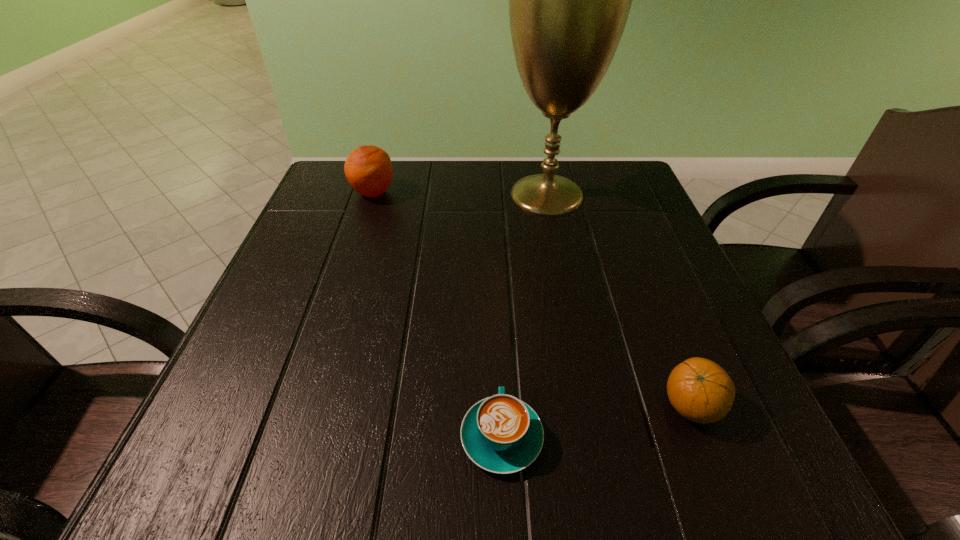
Where is `free spot located with the handle on the right side of the shortest object`? This screenshot has width=960, height=540. free spot located with the handle on the right side of the shortest object is located at coordinates (495, 276).

Find the location of `vacant space located with the handle on the right side of the shortest object`. vacant space located with the handle on the right side of the shortest object is located at coordinates (498, 352).

What are the coordinates of `trophy cup situated at the far edge` in the screenshot? It's located at (569, 0).

The width and height of the screenshot is (960, 540). I want to click on orange that is at the far edge, so click(x=368, y=169).

The width and height of the screenshot is (960, 540). Find the location of `orange that is positioned at the near edge`. orange that is positioned at the near edge is located at coordinates (700, 390).

Where is `cappuccino that is at the near edge`? This screenshot has height=540, width=960. cappuccino that is at the near edge is located at coordinates 501,434.

Image resolution: width=960 pixels, height=540 pixels. Identify the location of object located at the left edge. [368, 169].

At what (x,y) coordinates should I click in order to perform the action: click on trophy cup that is positioned at the right edge. Please return your answer as a coordinate pair (x, y). The width and height of the screenshot is (960, 540). Looking at the image, I should click on (569, 0).

This screenshot has height=540, width=960. I want to click on orange situated at the right edge, so click(700, 390).

This screenshot has width=960, height=540. In order to click on object present at the far left corner in this screenshot , I will do (368, 169).